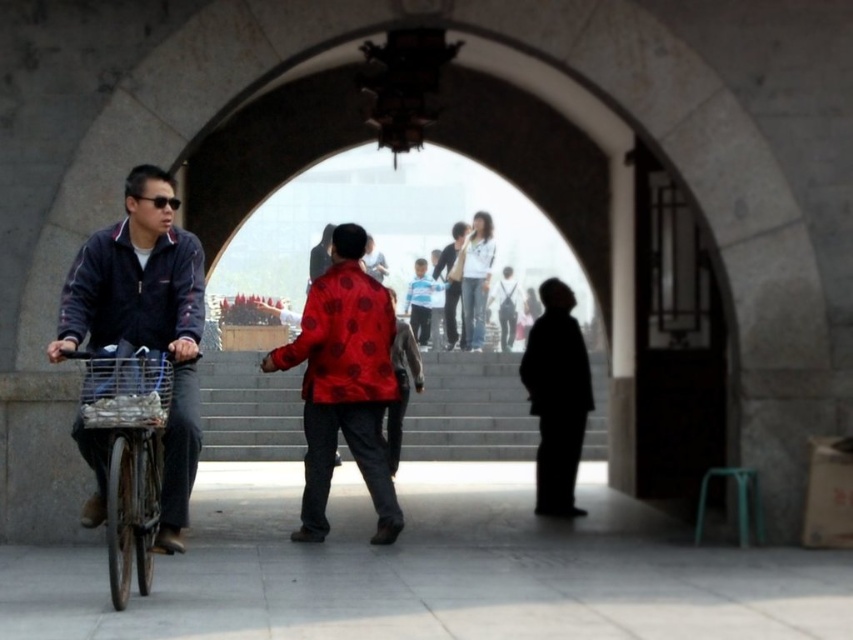
You are standing in front of the stone archway and see two points marked in the scene. Which point is closer to you, point (154, 170) or point (149, 529)?

Point (154, 170) is closer to you because it is further to the viewer than point (149, 529).